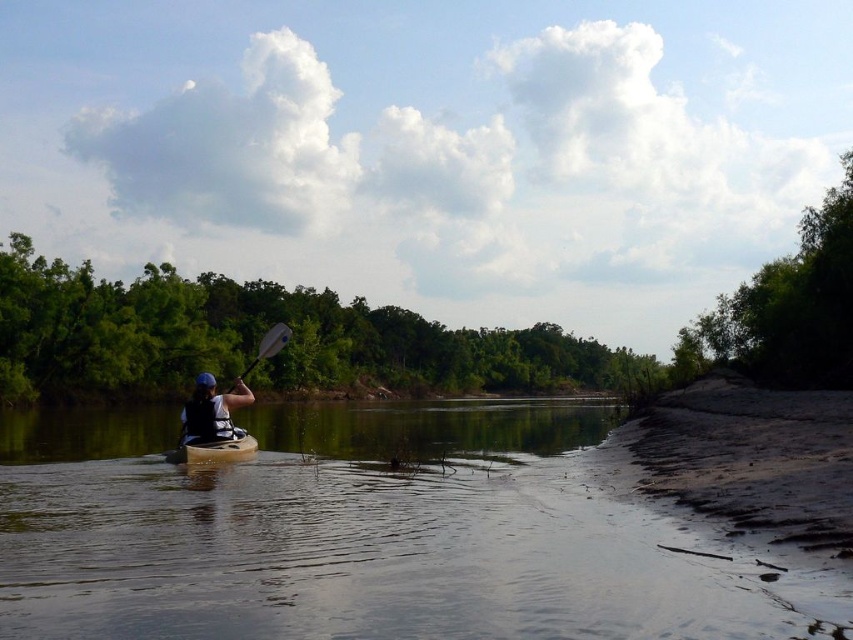
Can you confirm if brown matte water at center is shorter than matte black kayak at center?

No, brown matte water at center is not shorter than matte black kayak at center.

How far apart are brown matte water at center and matte black kayak at center?

The distance of brown matte water at center from matte black kayak at center is 56.14 feet.

Is point (360, 515) farther from viewer compared to point (228, 433)?

No, (360, 515) is closer to viewer.

You are a GUI agent. You are given a task and a screenshot of the screen. Output one action in this format:
    pyautogui.click(x=<x>, y=<y>)
    Task: Click on the brown matte water at center
    Image resolution: width=853 pixels, height=640 pixels.
    Given the screenshot: What is the action you would take?
    coord(373,532)

Is point (202, 422) behind point (270, 332)?

That is False.

Based on the photo, is matte black kayak at center above white wood paddle at center?

No, matte black kayak at center is not above white wood paddle at center.

The height and width of the screenshot is (640, 853). Identify the location of matte black kayak at center. (212, 412).

Is matte black kayak at center smaller than smooth brown canoe at center-left?

Yes.

Can you confirm if matte black kayak at center is bigger than smooth brown canoe at center-left?

Incorrect, matte black kayak at center is not larger than smooth brown canoe at center-left.

Locate an element on the screen. matte black kayak at center is located at coordinates (212, 412).

Image resolution: width=853 pixels, height=640 pixels. Identify the location of matte black kayak at center. (212, 412).